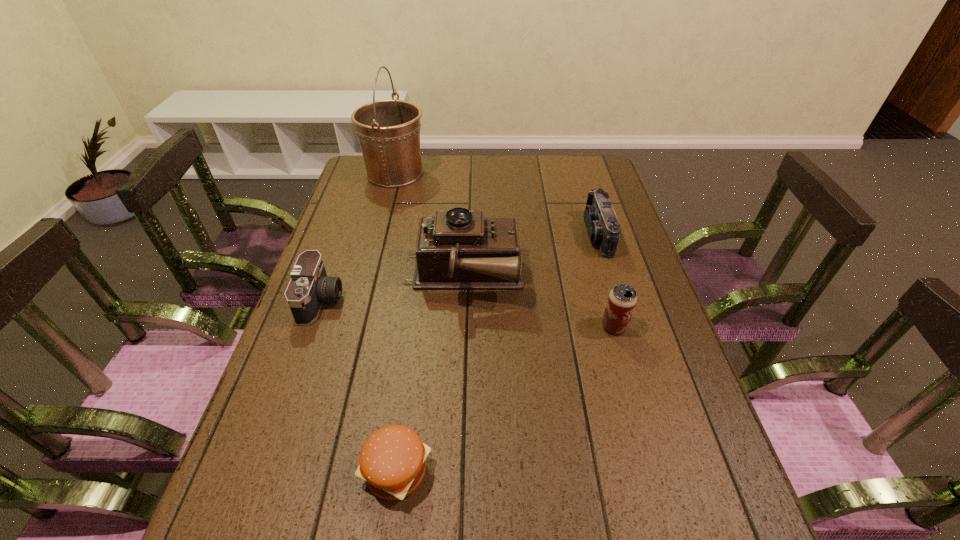
This screenshot has width=960, height=540. Identify the location of vacant point located between the nearest object and the beer can. (505, 399).

Find the location of a particular element. This screenshot has height=540, width=960. free space between the fifth shortest object and the camera is located at coordinates (393, 288).

You are a GUI agent. You are given a task and a screenshot of the screen. Output one action in this format:
    pyautogui.click(x=<x>, y=<y>)
    Task: Click on the free space between the shortest object and the beer can
    This screenshot has width=960, height=540.
    Given the screenshot: What is the action you would take?
    pyautogui.click(x=505, y=399)

Find the location of `vacant area that lies between the camcorder and the hamburger`. vacant area that lies between the camcorder and the hamburger is located at coordinates (497, 353).

You are a GUI agent. You are given a task and a screenshot of the screen. Output one action in this format:
    pyautogui.click(x=<x>, y=<y>)
    Task: Click on the free space between the camcorder and the nearest object
    This screenshot has height=540, width=960.
    Given the screenshot: What is the action you would take?
    pyautogui.click(x=497, y=353)

Locate which object ranks third in proximity to the beer can. Please provide its 2D coordinates. Your answer should be formatted as a tuple, i.e. [(x, y)], where the tuple contains the x and y coordinates of a point satisfying the conditions above.

[(392, 460)]

Locate an element on the screen. This screenshot has width=960, height=540. the third closest object to the nearest object is located at coordinates (622, 299).

Find the location of a particular element. vacant space that satisfies the following two spatial constraints: 1. on the front-facing side of the nearest object; 2. on the left side of the camera is located at coordinates tap(262, 471).

The width and height of the screenshot is (960, 540). What are the coordinates of `vacant space that satisfies the following two spatial constraints: 1. on the front-facing side of the camera; 2. on the right side of the beer can` in the screenshot? It's located at (313, 326).

The height and width of the screenshot is (540, 960). What are the coordinates of `blank space that satisfies the following two spatial constraints: 1. on the back side of the beer can; 2. on the front-facing side of the camera` in the screenshot? It's located at (607, 300).